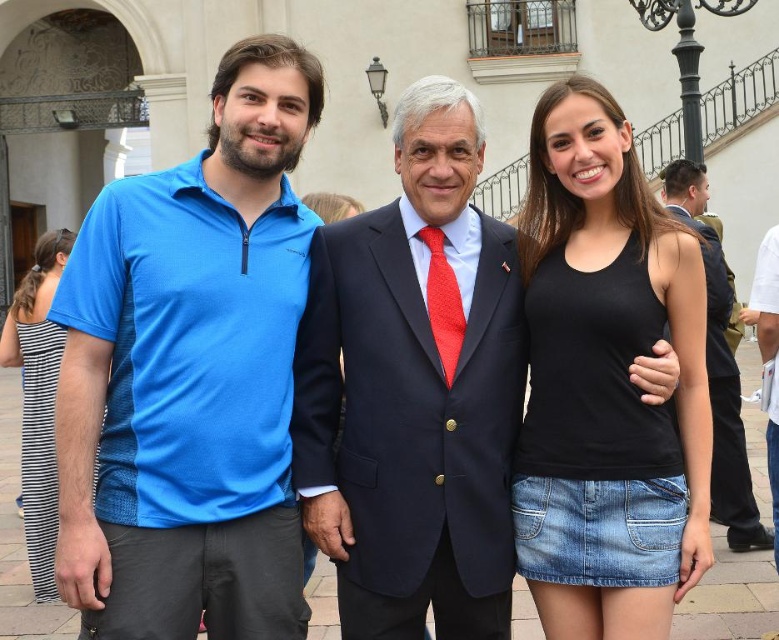
Question: Which point is farther to the camera?

Choices:
 (A) blue fabric shirt at center
 (B) striped cotton dress at left

Answer: (B)

Question: Does blue fabric shirt at center appear over white cotton shirt at right?

Choices:
 (A) no
 (B) yes

Answer: (B)

Question: Does navy blue suit at center have a greater width compared to white cotton shirt at right?

Choices:
 (A) yes
 (B) no

Answer: (A)

Question: Can you confirm if navy blue suit at center is bigger than white cotton shirt at right?

Choices:
 (A) yes
 (B) no

Answer: (B)

Question: Which point is farther from the camera taking this photo?

Choices:
 (A) (446, 374)
 (B) (732, 291)
 (C) (668, 564)

Answer: (B)

Question: Considering the real-world distances, which object is farthest from the red textured tie at center?

Choices:
 (A) black matte tank top at center
 (B) striped cotton dress at left
 (C) navy blue suit at center
 (D) blue fabric shirt at center

Answer: (B)